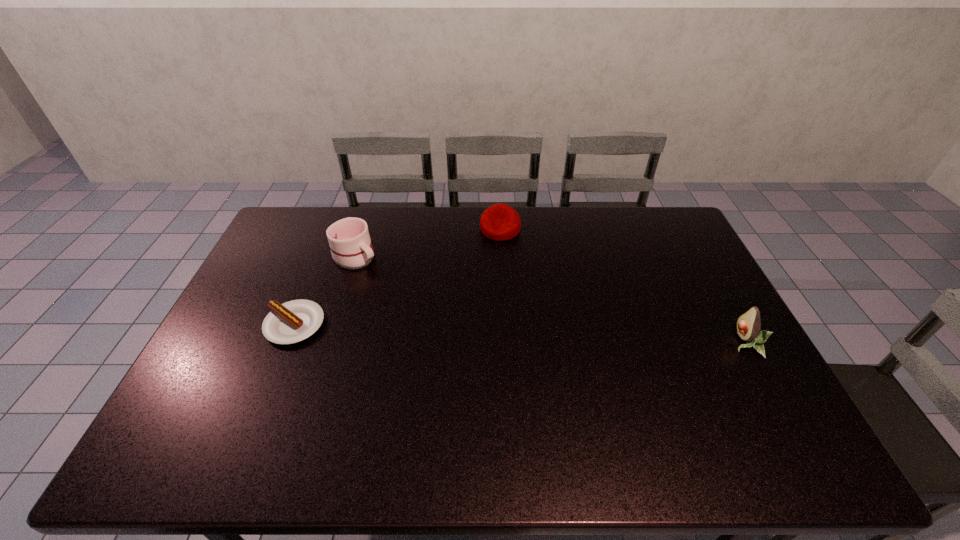
Locate an element on the screen. The width and height of the screenshot is (960, 540). free spot located 0.110m on the seat area of the second object from right to left is located at coordinates (499, 261).

Identify the location of free space located 0.090m on the seat area of the second object from right to left. (499, 258).

Locate an element on the screen. vacant space located 0.290m on the side with the handle of the mug is located at coordinates (424, 310).

You are a GUI agent. You are given a task and a screenshot of the screen. Output one action in this format:
    pyautogui.click(x=<x>, y=<y>)
    Task: Click on the vacant point located on the side with the handle of the mug
    The height and width of the screenshot is (540, 960).
    Given the screenshot: What is the action you would take?
    pyautogui.click(x=386, y=278)

Find the location of a particular element. The image size is (960, 540). blank space located on the side with the handle of the mug is located at coordinates (391, 283).

Identify the location of beanbag present at the far edge. This screenshot has height=540, width=960. (499, 222).

Locate an element on the screen. mug present at the far edge is located at coordinates (349, 240).

Locate an element on the screen. The width and height of the screenshot is (960, 540). object located at the left edge is located at coordinates (291, 322).

You are a GUI agent. You are given a task and a screenshot of the screen. Output one action in this format:
    pyautogui.click(x=<x>, y=<y>)
    Task: Click on the object located at the right edge
    Image resolution: width=960 pixels, height=540 pixels.
    Given the screenshot: What is the action you would take?
    (749, 323)

You are a GUI agent. You are given a task and a screenshot of the screen. Output one action in this format:
    pyautogui.click(x=<x>, y=<y>)
    Task: Click on the free space at the far edge of the desktop
    Image resolution: width=960 pixels, height=540 pixels.
    Given the screenshot: What is the action you would take?
    pyautogui.click(x=425, y=234)